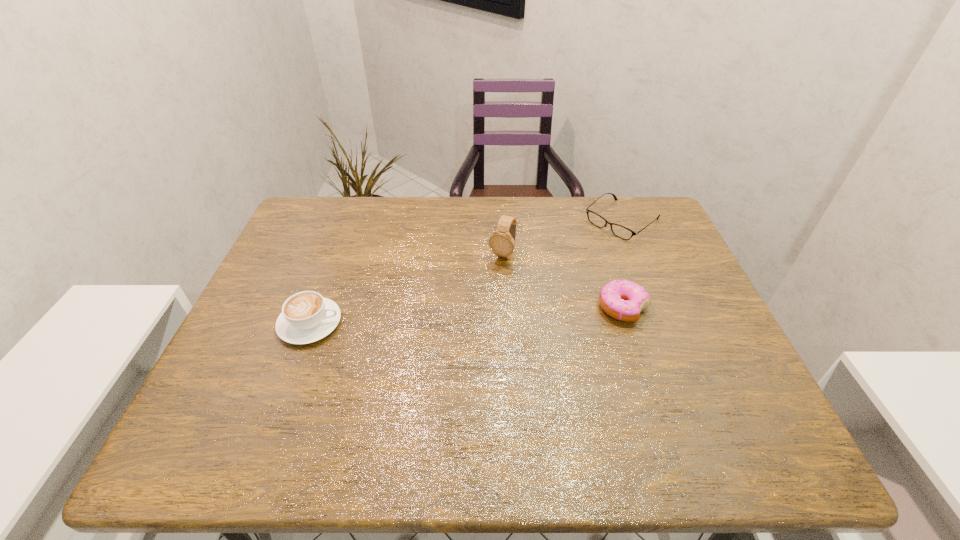
This screenshot has width=960, height=540. Find the location of `free space located 0.180m on the front-facing side of the shortest object`. free space located 0.180m on the front-facing side of the shortest object is located at coordinates (564, 266).

Find the location of a particular element. This screenshot has height=540, width=960. blank area located 0.160m on the face of the tallest object is located at coordinates click(476, 304).

Find the location of a particular element. vacant space located on the face of the tallest object is located at coordinates (452, 347).

What are the coordinates of `vacant space positioned on the face of the tallest object` in the screenshot? It's located at (478, 301).

Image resolution: width=960 pixels, height=540 pixels. In order to click on object that is positioned at the far edge in this screenshot , I will do `click(620, 231)`.

This screenshot has width=960, height=540. Identify the location of object at the left edge. (306, 317).

This screenshot has height=540, width=960. Find the location of `doughnut located at the right edge`. doughnut located at the right edge is located at coordinates (623, 300).

I want to click on spectacles that is at the right edge, so click(620, 231).

Locate an element on the screen. The image size is (960, 540). object present at the far right corner is located at coordinates (620, 231).

Where is `free region at the far edge of the desktop`? The width and height of the screenshot is (960, 540). free region at the far edge of the desktop is located at coordinates (379, 199).